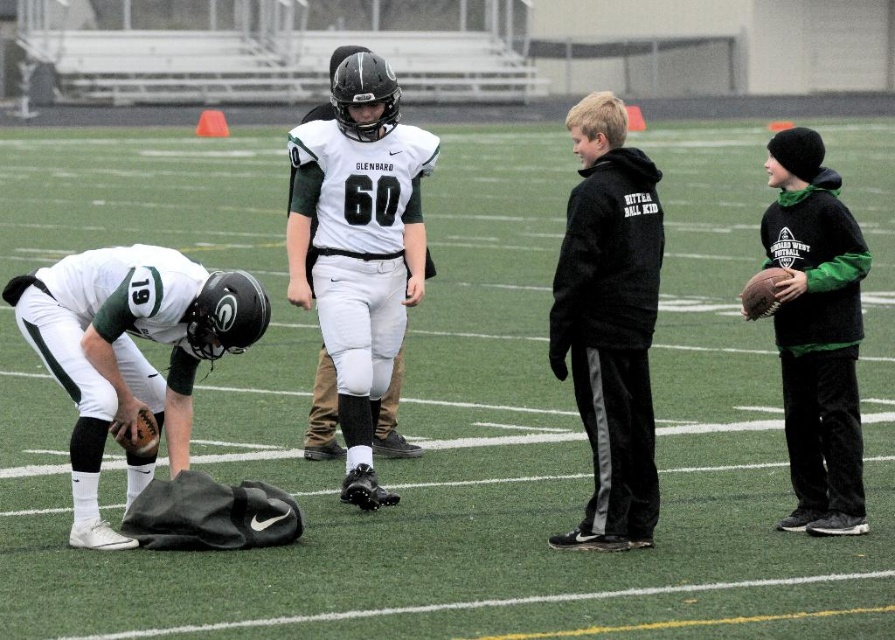
Question: Among these points, which one is farthest from the camera?

Choices:
 (A) (41, 276)
 (B) (798, 147)
 (C) (611, 378)

Answer: (B)

Question: Is matte white uniform at lower left to the right of black fleece hoodie at center from the viewer's perspective?

Choices:
 (A) yes
 (B) no

Answer: (B)

Question: Among these points, which one is farthest from the camera?

Choices:
 (A) (599, 332)
 (B) (139, 464)

Answer: (B)

Question: Does matte white uniform at lower left appear on the right side of black fleece hoodie at center?

Choices:
 (A) yes
 (B) no

Answer: (B)

Question: Can you confirm if matte white uniform at lower left is positioned below dark green fleece hoodie at right?

Choices:
 (A) yes
 (B) no

Answer: (A)

Question: Considering the real-world distances, which object is closest to the matte white uniform at lower left?

Choices:
 (A) dark green fleece hoodie at right
 (B) black fleece hoodie at center

Answer: (B)